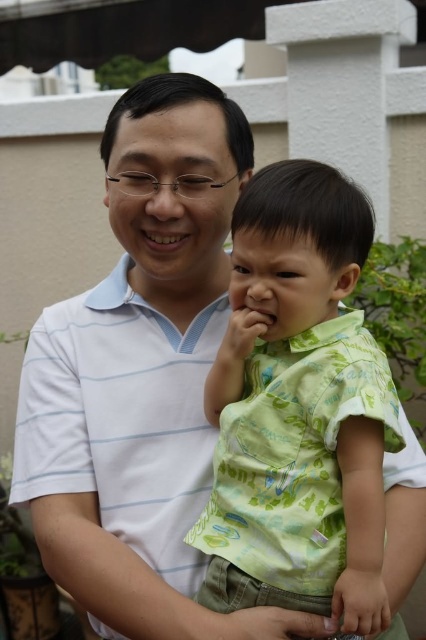
Can you confirm if green printed shirt at center is smaller than white striped polo shirt at center?

Correct, green printed shirt at center occupies less space than white striped polo shirt at center.

Between point (227, 381) and point (169, 340), which one is positioned in front?

Point (227, 381) is more forward.

Measure the distance between green printed shirt at center and camera.

green printed shirt at center is 37.51 inches from camera.

Locate an element on the screen. The height and width of the screenshot is (640, 426). green printed shirt at center is located at coordinates (298, 408).